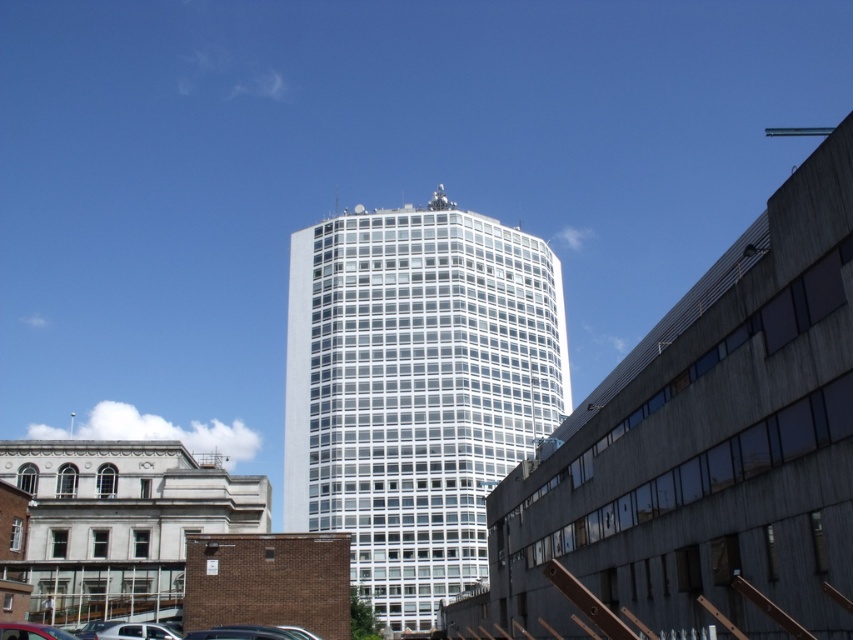
You are a photographer standing in front of the white glass tower at center and the matte red car at lower left. You want to take a photo that includes both objects in the frame. Which object should you position closer to the camera to ensure both are visible without zooming in?

You should position the matte red car at lower left closer to the camera because the white glass tower at center is further away from you. By moving the car forward, both objects will be within the same focal plane, ensuring they are both visible without zooming.

You are standing in front of the modern highrise building in the center and looking towards the right side of the image. There are two points marked as point 1 at coordinates point (102, 636) and point 2 at coordinates point (15, 625). Which point is closer to you?

Point (102, 636) is further to the camera than point (15, 625), so point (15, 625) is closer to you.

You are standing at the point labeled as point (415, 388) in the image. What structure are you facing directly?

The point (415, 388) indicates the white glass tower at center, so you are facing the white glass tower at center directly.